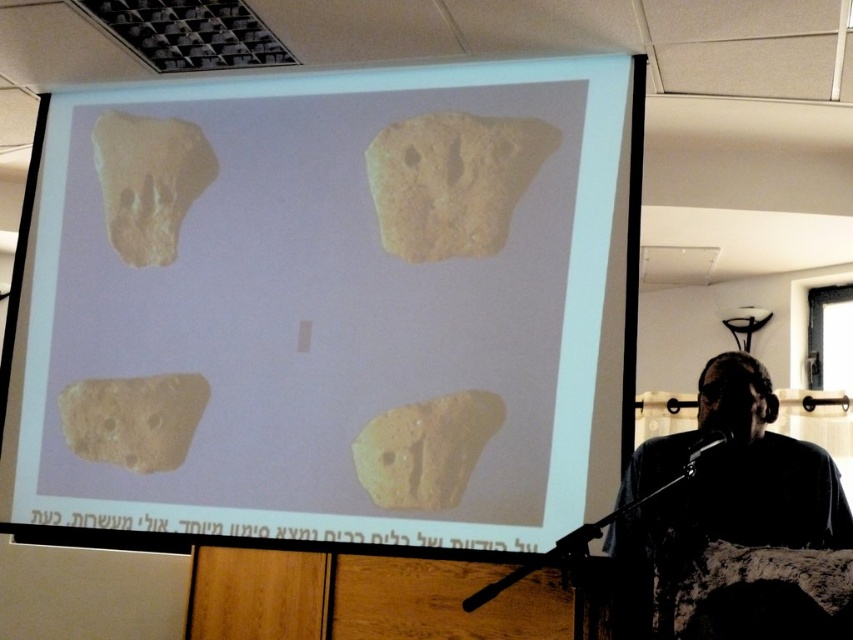
Question: Which point appears closest to the camera in this image?

Choices:
 (A) (166, 179)
 (B) (712, 499)
 (C) (465, 460)

Answer: (B)

Question: Is beige rough stone at upper left below yellow matte stone at lower center?

Choices:
 (A) no
 (B) yes

Answer: (A)

Question: Is beige stone fragments at center above yellowish stone at center?

Choices:
 (A) no
 (B) yes

Answer: (A)

Question: Which point appears farthest from the camera in this image?

Choices:
 (A) (386, 204)
 (B) (373, 477)
 (C) (178, 154)
 (D) (181, 396)

Answer: (C)

Question: Can you confirm if silhouette fabric at lower right is positioned to the left of brown matte stone at lower left?

Choices:
 (A) no
 (B) yes

Answer: (A)

Question: Which object is closer to the camera taking this photo?

Choices:
 (A) yellowish stone at center
 (B) yellow matte stone at lower center
 (C) silhouette fabric at lower right

Answer: (C)